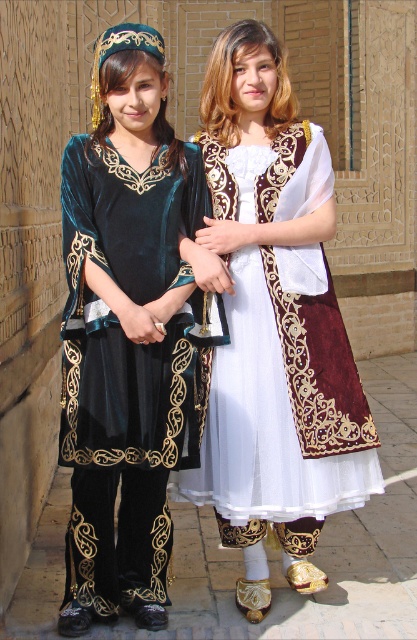
Question: Which point is closer to the camera?

Choices:
 (A) velvet teal dress at center
 (B) white velvet dress at center

Answer: (A)

Question: Can you confirm if velvet teal dress at center is positioned to the left of white velvet dress at center?

Choices:
 (A) yes
 (B) no

Answer: (A)

Question: Does velvet teal dress at center appear under white velvet dress at center?

Choices:
 (A) no
 (B) yes

Answer: (B)

Question: Which of the following is the farthest from the observer?

Choices:
 (A) (316, 364)
 (B) (102, 276)

Answer: (A)

Question: Does velvet teal dress at center appear under white velvet dress at center?

Choices:
 (A) yes
 (B) no

Answer: (A)